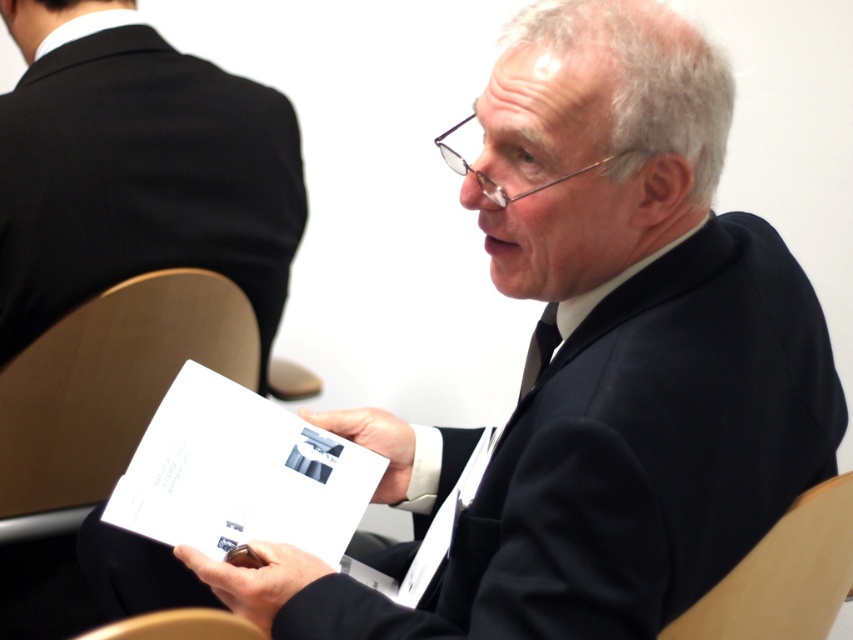
You are a person who is 6 feet tall. You are standing in the conference room and want to move from the light wood chair at right to the wooden at lower left. Can you walk directly between them without any obstacles?

The light wood chair at right and wooden at lower left are 20.77 inches apart, which is less than the typical 24 inches required for comfortable passage. Since you are 6 feet tall, you might have difficulty moving between them without bumping into one or both chairs. It is not advisable to attempt walking directly between them.

You are organizing a meeting in this room and need to seat two people. You have a light wood chair at right and a wooden at lower left. Which chair can accommodate a larger person more comfortably?

The light wood chair at right is bigger than wooden at lower left, so it can accommodate a larger person more comfortably.

You are organizing a meeting and need to place a 1.2 meter wide tablecloth. You see the black suit at upper left and the wooden at lower left. Which object can the tablecloth fully cover?

The black suit at upper left is larger in size than wooden at lower left, so the tablecloth can fully cover the black suit at upper left.